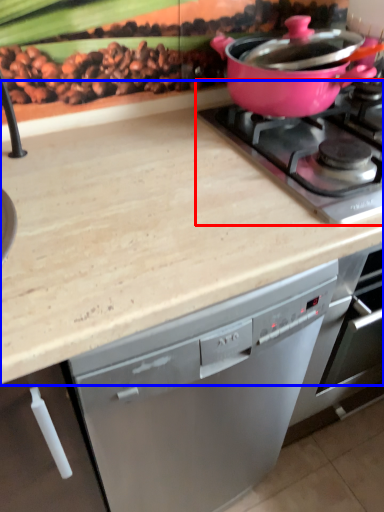
Question: Which of the following is the farthest to the observer, gas stove (highlighted by a red box) or countertop (highlighted by a blue box)?

Choices:
 (A) gas stove
 (B) countertop

Answer: (A)